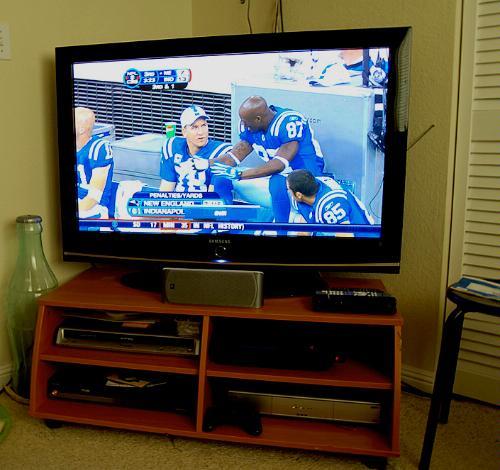
The height and width of the screenshot is (470, 500). I want to click on speaker case, so click(x=258, y=296).